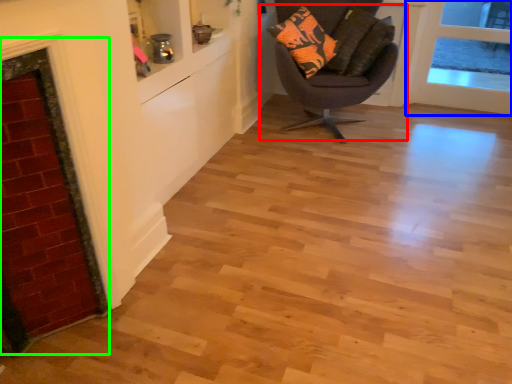
Question: Which object is the closest to the chair (highlighted by a red box)? Choose among these: door (highlighted by a blue box) or fireplace (highlighted by a green box).

Choices:
 (A) door
 (B) fireplace

Answer: (A)